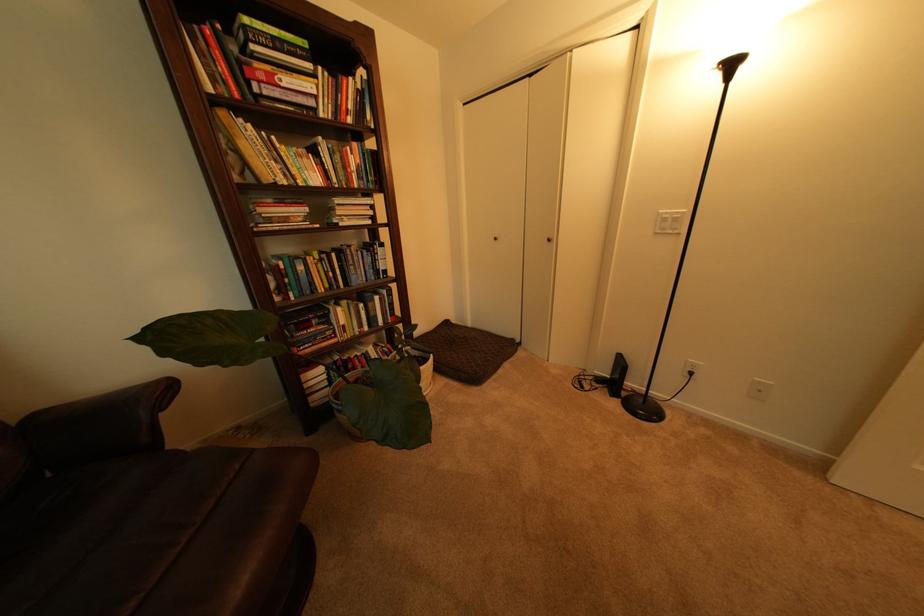
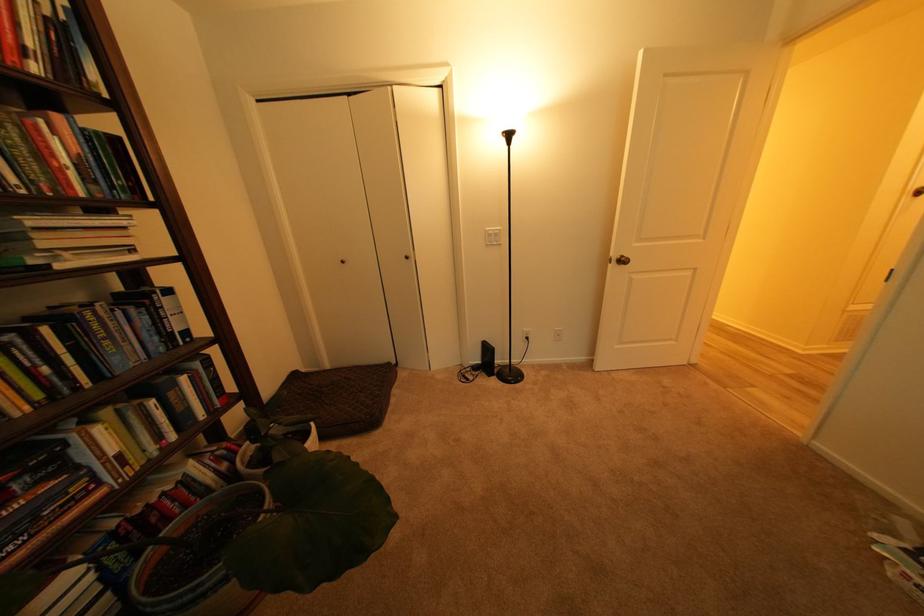
Where in the second image is the point corresponding to pixel 377 262 from the first image?

(150, 326)